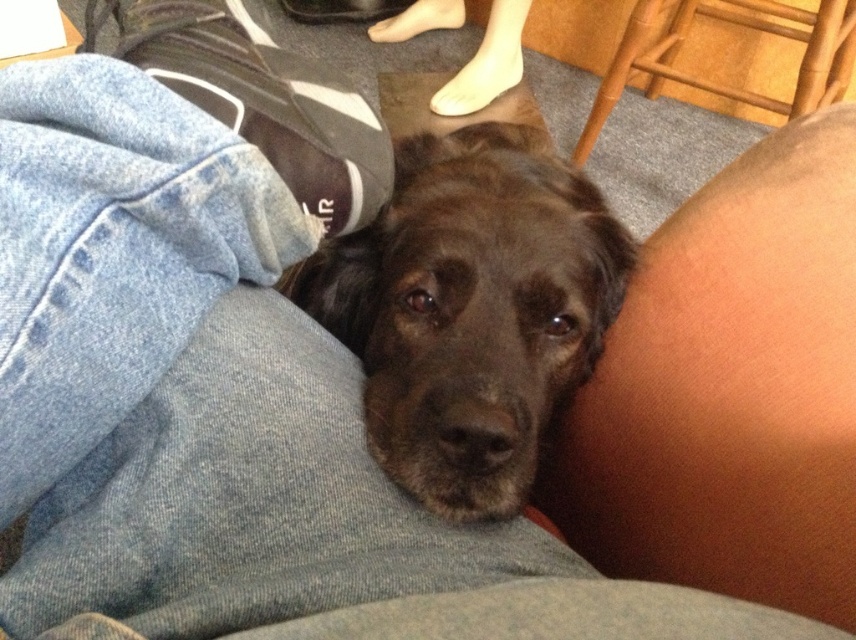
You are an interior designer assessing the layout of a living room. You notice the bamboo chair at upper right and the skinny white foot at upper center. Which object is located below the other?

The bamboo chair at upper right is positioned under the skinny white foot at upper center, meaning the chair is below the foot.

Based on the coordinates provided, can you identify the object located at point (471, 308) in the image?

The shiny brown fur at center is located at point (471, 308).